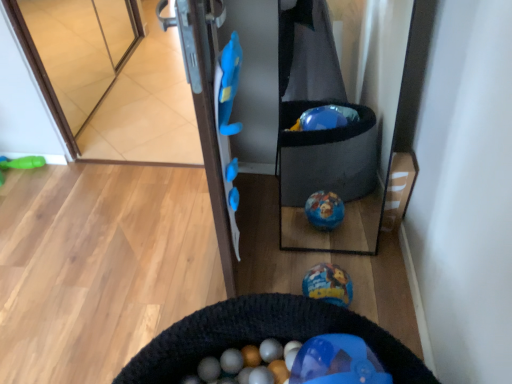
You are a GUI agent. You are given a task and a screenshot of the screen. Output one action in this format:
    pyautogui.click(x=<x>, y=<y>)
    Task: Click on the free space above shiny metallic ball at center, which is counted as the second toy, starting from the top (from a real-world perspective)
    Image resolution: width=512 pixels, height=384 pixels.
    Given the screenshot: What is the action you would take?
    pyautogui.click(x=327, y=281)